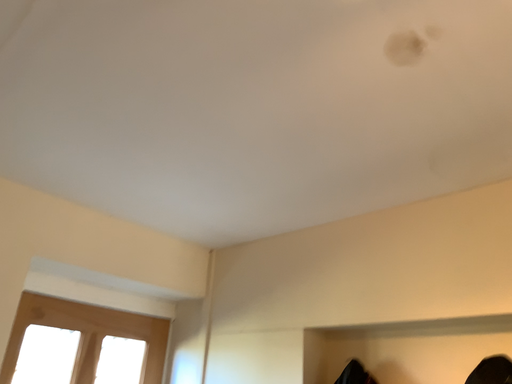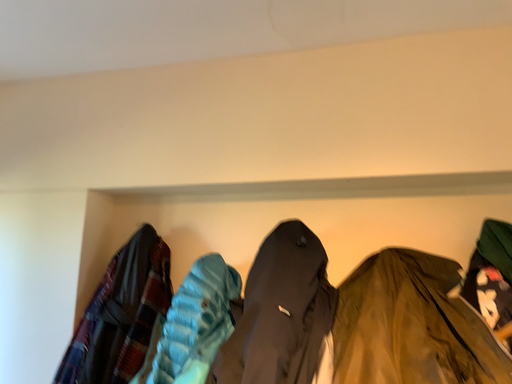
Question: Which way did the camera rotate in the video?

Choices:
 (A) rotated upward
 (B) rotated downward

Answer: (B)